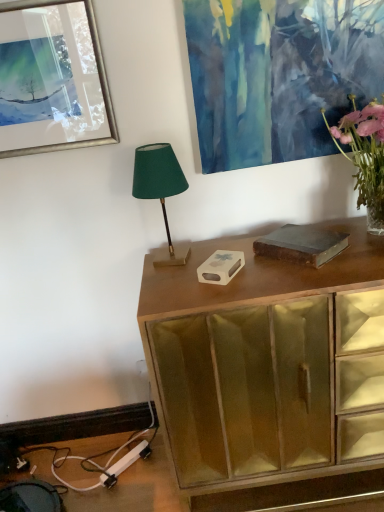
This screenshot has height=512, width=384. Describe the element at coordinates (365, 156) in the screenshot. I see `pink glass vase at upper right` at that location.

What do you see at coordinates (52, 79) in the screenshot? This screenshot has height=512, width=384. I see `metallic silver picture frame at upper left` at bounding box center [52, 79].

Find the location of a particular element. Image resolution: width=384 pixels, height=512 pixels. pink glass vase at upper right is located at coordinates (365, 156).

The image size is (384, 512). I want to click on houseplant above the wooden cabinet at center (from the image's perspective), so (x=365, y=156).

Is wooden cabinet at center taller than pink glass vase at upper right?

Indeed, wooden cabinet at center has a greater height compared to pink glass vase at upper right.

Is wooden cabinet at center positioned with its back to pink glass vase at upper right?

wooden cabinet at center does not have its back to pink glass vase at upper right.

Between green fabric lampshade at center and metallic silver picture frame at upper left, which one appears on the left side from the viewer's perspective?

metallic silver picture frame at upper left.

Between green fabric lampshade at center and metallic silver picture frame at upper left, which one has more height?

metallic silver picture frame at upper left.

Is green fabric lampshade at center not close to metallic silver picture frame at upper left?

They are positioned close to each other.

Identify the location of picture frame behind the green fabric lampshade at center. This screenshot has height=512, width=384. (52, 79).

Considering the relative sizes of green fabric lampshade at center and wooden cabinet at center in the image provided, is green fabric lampshade at center smaller than wooden cabinet at center?

Correct, green fabric lampshade at center occupies less space than wooden cabinet at center.

How different are the orientations of green fabric lampshade at center and wooden cabinet at center in degrees?

1.74 degrees separate the facing orientations of green fabric lampshade at center and wooden cabinet at center.

From the picture: From a real-world perspective, who is located higher, green fabric lampshade at center or wooden cabinet at center?

From a 3D spatial view, green fabric lampshade at center is above.

Is green fabric lampshade at center touching wooden cabinet at center?

They are not placed beside each other.

Is wooden cabinet at center in front of or behind metallic silver picture frame at upper left in the image?

wooden cabinet at center is positioned closer to the viewer than metallic silver picture frame at upper left.

Is wooden cabinet at center at the left side of metallic silver picture frame at upper left?

No.

Is wooden cabinet at center looking in the opposite direction of metallic silver picture frame at upper left?

No, wooden cabinet at center is not facing the opposite direction of metallic silver picture frame at upper left.

Considering the sizes of pink glass vase at upper right and metallic silver picture frame at upper left in the image, is pink glass vase at upper right bigger or smaller than metallic silver picture frame at upper left?

Clearly, pink glass vase at upper right is larger in size than metallic silver picture frame at upper left.

Considering the positions of objects pink glass vase at upper right and metallic silver picture frame at upper left in the image provided, who is more to the left, pink glass vase at upper right or metallic silver picture frame at upper left?

From the viewer's perspective, metallic silver picture frame at upper left appears more on the left side.

Could you tell me if pink glass vase at upper right is facing metallic silver picture frame at upper left?

No, pink glass vase at upper right is not oriented towards metallic silver picture frame at upper left.

Is pink glass vase at upper right not inside metallic silver picture frame at upper left?

That's correct, pink glass vase at upper right is outside of metallic silver picture frame at upper left.

Is wooden cabinet at center in contact with green fabric lampshade at center?

wooden cabinet at center and green fabric lampshade at center are clearly separated.

From the image's perspective, is wooden cabinet at center located beneath green fabric lampshade at center?

Yes.

Measure the distance between wooden cabinet at center and green fabric lampshade at center.

15.75 inches.

Does point (331, 302) come closer to viewer compared to point (145, 164)?

That is True.

Are metallic silver picture frame at upper left and wooden cabinet at center making contact?

No, metallic silver picture frame at upper left is not next to wooden cabinet at center.

Who is bigger, metallic silver picture frame at upper left or wooden cabinet at center?

wooden cabinet at center is bigger.

From the image's perspective, does metallic silver picture frame at upper left appear higher than wooden cabinet at center?

Yes, from the image's perspective, metallic silver picture frame at upper left is above wooden cabinet at center.

Visually, is metallic silver picture frame at upper left positioned to the left or to the right of wooden cabinet at center?

In the image, metallic silver picture frame at upper left appears on the left side of wooden cabinet at center.

This screenshot has height=512, width=384. Find the location of `houseplant that appears behind the wooden cabinet at center`. houseplant that appears behind the wooden cabinet at center is located at coordinates (365, 156).

Identify the location of lamp below the metallic silver picture frame at upper left (from the image's perspective). Image resolution: width=384 pixels, height=512 pixels. (160, 190).

From the image, which object appears to be farther from metallic silver picture frame at upper left, wooden cabinet at center or pink glass vase at upper right?

Based on the image, pink glass vase at upper right appears to be further to metallic silver picture frame at upper left.

Looking at the image, which one is located further to wooden cabinet at center, metallic silver picture frame at upper left or pink glass vase at upper right?

The object further to wooden cabinet at center is metallic silver picture frame at upper left.

From the image, which object appears to be farther from pink glass vase at upper right, wooden cabinet at center or green fabric lampshade at center?

green fabric lampshade at center lies further to pink glass vase at upper right than the other object.

Consider the image. Looking at the image, which one is located further to metallic silver picture frame at upper left, pink glass vase at upper right or green fabric lampshade at center?

pink glass vase at upper right is positioned further to the anchor metallic silver picture frame at upper left.

Which object lies nearer to the anchor point pink glass vase at upper right, metallic silver picture frame at upper left or green fabric lampshade at center?

green fabric lampshade at center.

Estimate the real-world distances between objects in this image. Which object is further from metallic silver picture frame at upper left, green fabric lampshade at center or pink glass vase at upper right?

Based on the image, pink glass vase at upper right appears to be further to metallic silver picture frame at upper left.

Considering their positions, is metallic silver picture frame at upper left positioned further to green fabric lampshade at center than wooden cabinet at center?

Among the two, wooden cabinet at center is located further to green fabric lampshade at center.

From the image, which object appears to be nearer to wooden cabinet at center, metallic silver picture frame at upper left or green fabric lampshade at center?

green fabric lampshade at center.

Find the location of a particular element. chest of drawers between metallic silver picture frame at upper left and pink glass vase at upper right in the horizontal direction is located at coordinates (269, 369).

Where is `lamp that lies between pink glass vase at upper right and wooden cabinet at center from top to bottom`? This screenshot has width=384, height=512. lamp that lies between pink glass vase at upper right and wooden cabinet at center from top to bottom is located at coordinates (160, 190).

Find the location of a particular element. Image resolution: width=384 pixels, height=512 pixels. lamp between metallic silver picture frame at upper left and pink glass vase at upper right is located at coordinates (160, 190).

Locate an element on the screen. lamp that lies between metallic silver picture frame at upper left and wooden cabinet at center from top to bottom is located at coordinates (160, 190).